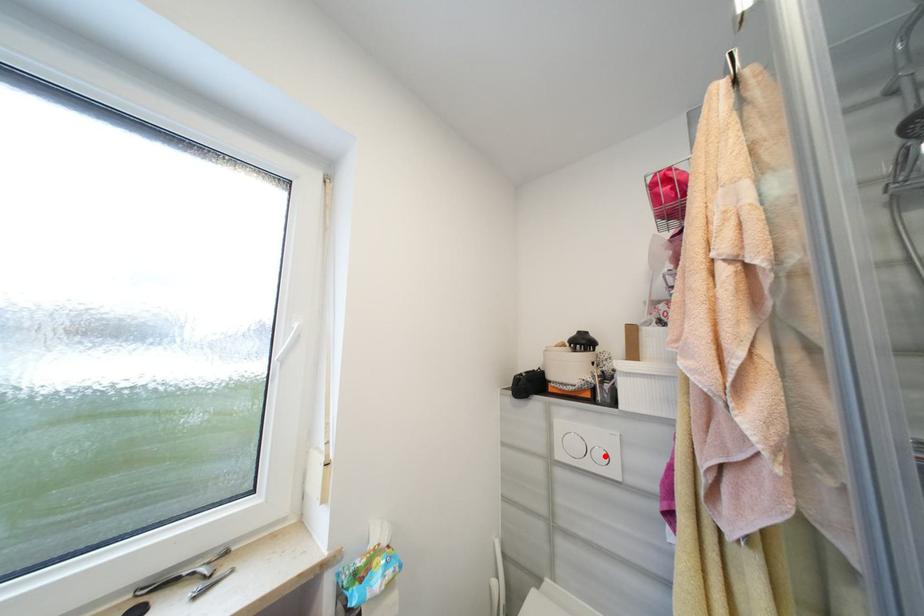
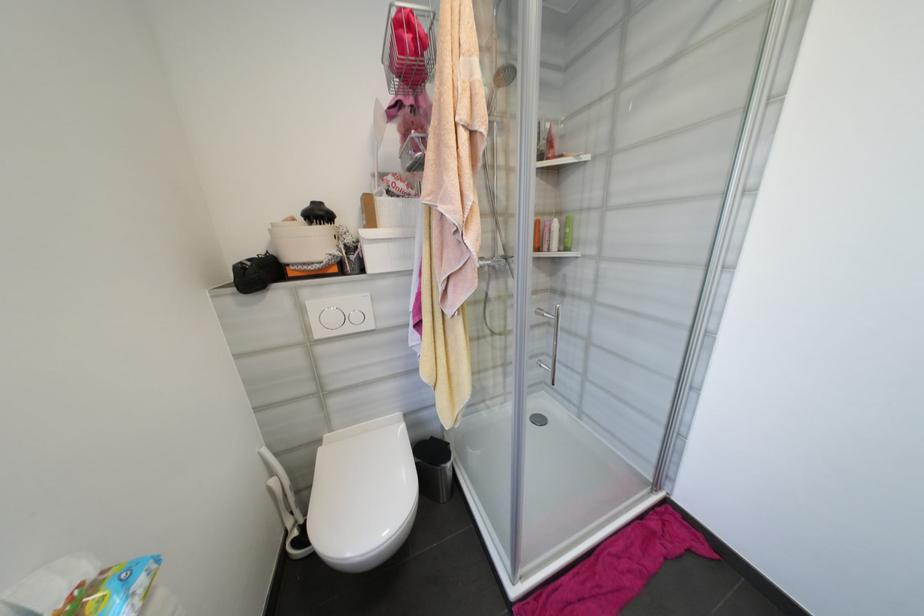
Locate, in the second image, the point that corresponds to the highlighted location in the first image.

(361, 318)